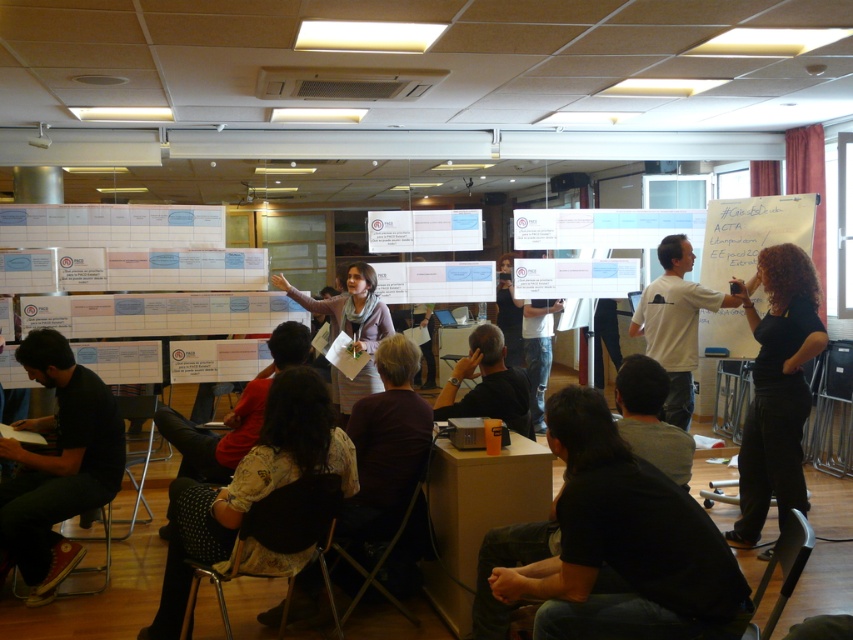
Does point (801, 264) come in front of point (355, 264)?

Yes, it is.

Is black matte shirt at right closer to the viewer compared to matte gray sweater at center?

Yes, black matte shirt at right is closer to the viewer.

This screenshot has width=853, height=640. Find the location of `black matte shirt at right`. black matte shirt at right is located at coordinates (776, 388).

The image size is (853, 640). I want to click on black matte shirt at right, so (776, 388).

This screenshot has width=853, height=640. What are the coordinates of `white paperboard at upper right` in the screenshot? It's located at (751, 234).

Can you confirm if white paperboard at upper right is positioned above matte gray sweater at center?

Correct, white paperboard at upper right is located above matte gray sweater at center.

The width and height of the screenshot is (853, 640). I want to click on white paperboard at upper right, so click(751, 234).

You are a GUI agent. You are given a task and a screenshot of the screen. Output one action in this format:
    pyautogui.click(x=<x>, y=<y>)
    Task: Click on the white paperboard at upper right
    
    Given the screenshot: What is the action you would take?
    pyautogui.click(x=751, y=234)

Is white t-shirt at center to the right of matte gray sweater at center from the viewer's perspective?

Yes, white t-shirt at center is to the right of matte gray sweater at center.

Which is more to the left, white t-shirt at center or matte gray sweater at center?

matte gray sweater at center is more to the left.

Locate an element on the screen. The image size is (853, 640). white t-shirt at center is located at coordinates (675, 323).